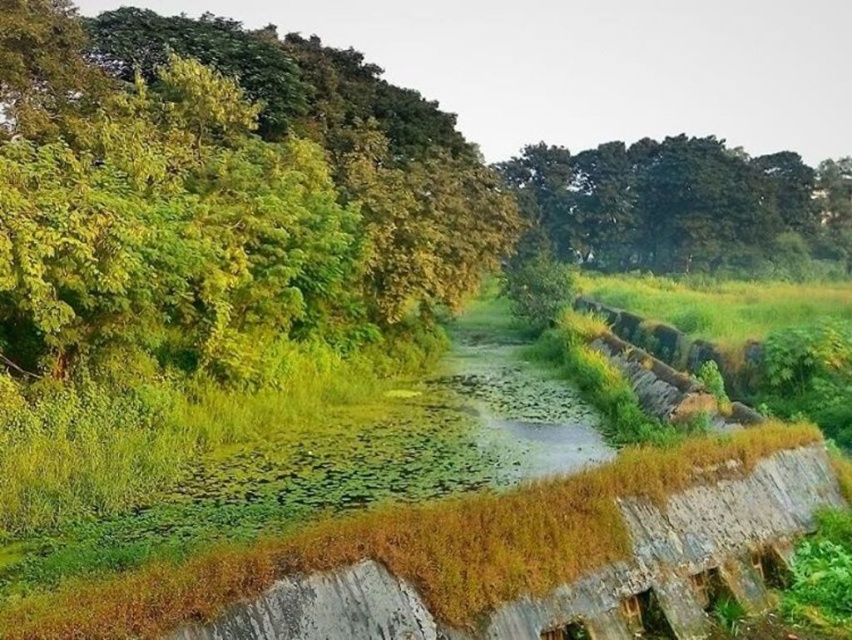
You are standing in the middle of the waterway and want to determine which tree is taller between the green leafy tree at left and the green leafy tree at upper center. Based on your observation, which one is taller?

The green leafy tree at upper center is taller than the green leafy tree at left.

You are a bird looking for a nesting spot. You see two trees in the image, the green leafy tree at left and the green leafy tree at upper center. Which tree is taller and would provide a better vantage point?

The green leafy tree at upper center is taller than the green leafy tree at left, so it would provide a better vantage point.

You are standing in the middle of the waterway and see two points marked in the scene. Which point is closer to you? The points are point at (211, 140) and point at (626, 157).

Point at (211, 140) is closer to the viewer than point at (626, 157).